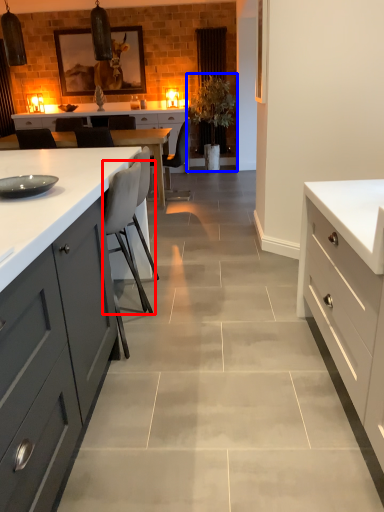
Question: Which point is further to the camera, chair (highlighted by a red box) or plant (highlighted by a blue box)?

Choices:
 (A) chair
 (B) plant

Answer: (B)